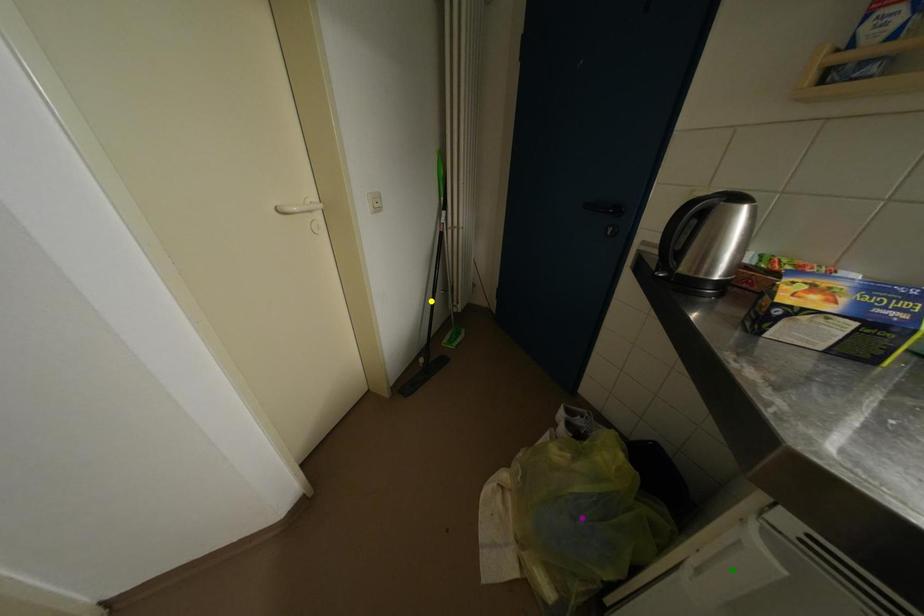
Order these from nearest to farthest:
1. purple point
2. yellow point
3. green point

1. yellow point
2. purple point
3. green point